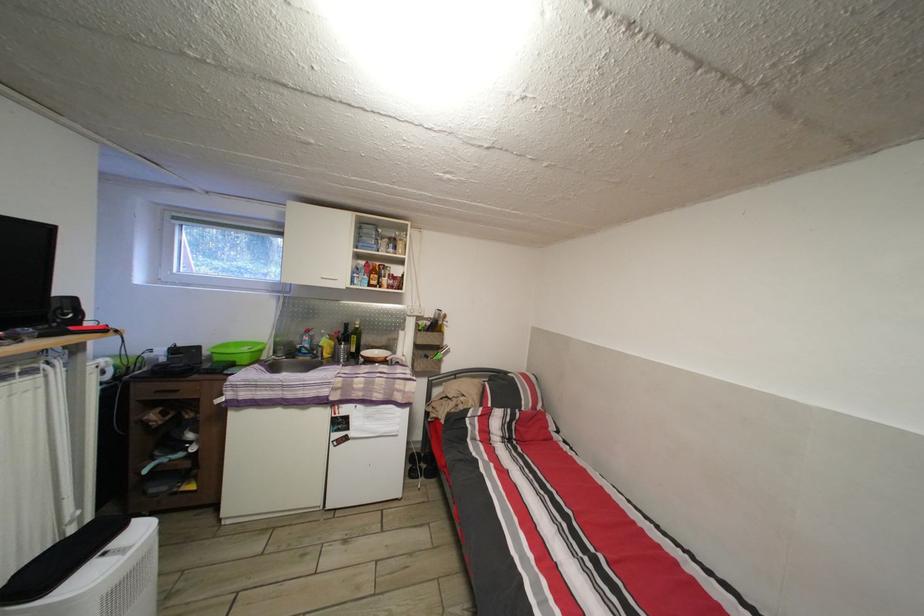
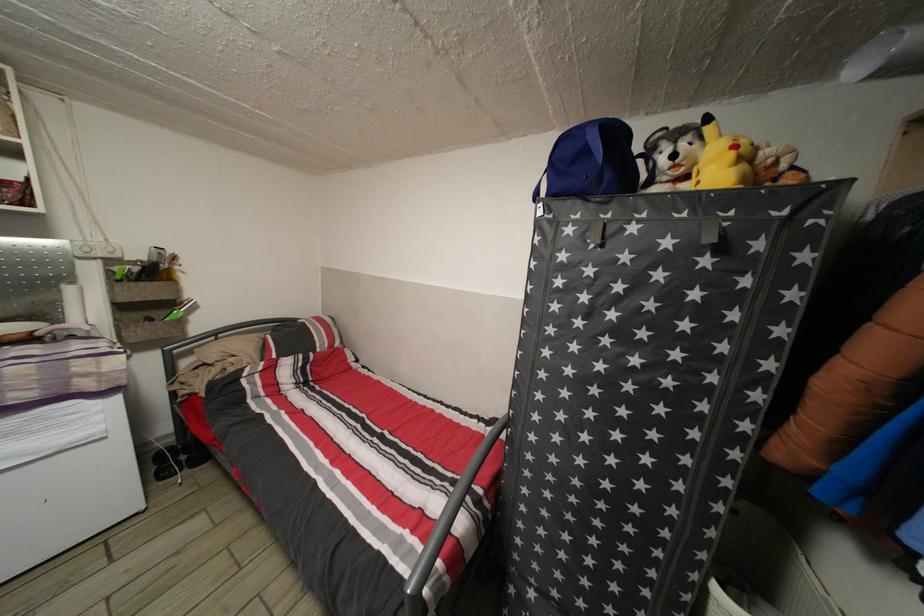
The point at (442, 341) is marked in the first image. Where is the corresponding point in the second image?

(164, 291)